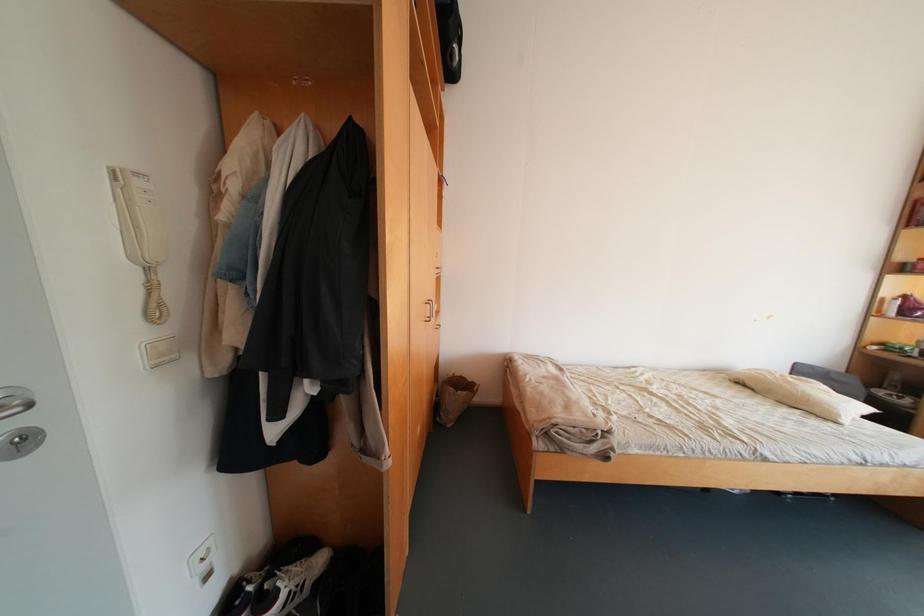
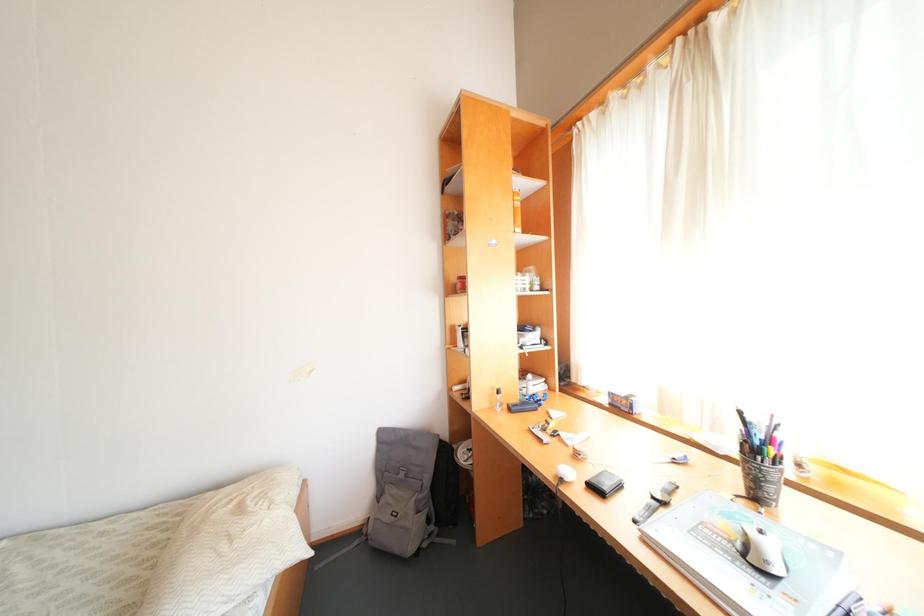
Question: Which direction would the cameraman need to move to produce the second image? Reply with the corresponding letter.

Choices:
 (A) Left
 (B) Right
 (C) Forward
 (D) Backward

Answer: (B)